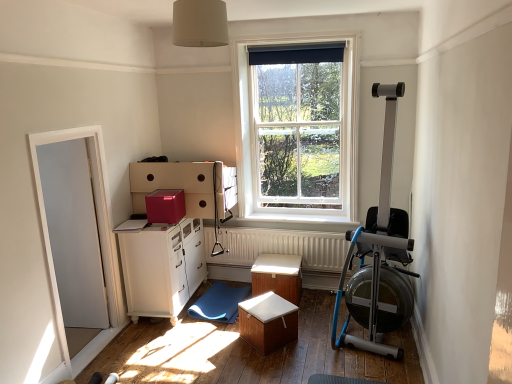
Question: Looking at the image, does wooden table at center, the first table positioned from the front, seem bigger or smaller compared to white wooden window at center?

Choices:
 (A) big
 (B) small

Answer: (B)

Question: From a real-world perspective, is wooden table at center, which appears as the 2th table when viewed from the back, positioned above or below white wooden window at center?

Choices:
 (A) above
 (B) below

Answer: (B)

Question: Based on their relative distances, which object is nearer to the wooden table at center, which appears as the 2th table when viewed from the back?

Choices:
 (A) white textured radiator at center
 (B) blue rubber mat at lower center
 (C) silver metallic rowing machine at right
 (D) white wooden window at center
 (E) white glossy door at left

Answer: (B)

Question: Which object is positioned farthest from the wooden table at center, which appears as the 2th table when viewed from the back?

Choices:
 (A) white textured radiator at center
 (B) white glossy cabinet at lower left
 (C) matte pink cardboard box at upper center
 (D) white wooden window at center
 (E) silver metallic rowing machine at right

Answer: (D)